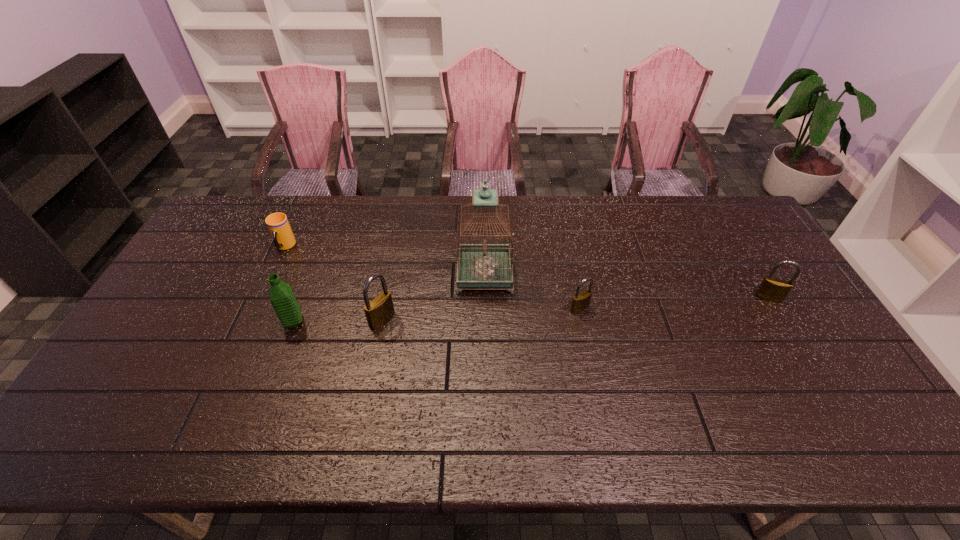
What are the coordinates of `vacant space located on the left of the second padlock from left to right` in the screenshot? It's located at (491, 308).

You are a GUI agent. You are given a task and a screenshot of the screen. Output one action in this format:
    pyautogui.click(x=<x>, y=<y>)
    Task: Click on the vacant space located on the front of the second shortest padlock
    The width and height of the screenshot is (960, 540).
    Given the screenshot: What is the action you would take?
    pyautogui.click(x=791, y=336)

The height and width of the screenshot is (540, 960). Find the location of `vacant space situated at the door of the third object from right to left`. vacant space situated at the door of the third object from right to left is located at coordinates (377, 274).

I want to click on vacant point located 0.240m at the door of the third object from right to left, so point(380,274).

Where is `vacant area located 0.390m at the door of the third object from right to left`? This screenshot has height=540, width=960. vacant area located 0.390m at the door of the third object from right to left is located at coordinates (332, 274).

Where is `vacant space positioned on the side of the cup with the handle`? vacant space positioned on the side of the cup with the handle is located at coordinates (265, 291).

Where is `vacant space located 0.210m on the front of the second object from left to right`? vacant space located 0.210m on the front of the second object from left to right is located at coordinates (265, 400).

Image resolution: width=960 pixels, height=540 pixels. In order to click on object that is at the right edge in this screenshot , I will do `click(772, 289)`.

Locate an element on the screen. Image resolution: width=960 pixels, height=540 pixels. free space at the far edge of the desktop is located at coordinates (422, 210).

You are a GUI agent. You are given a task and a screenshot of the screen. Output one action in this format:
    pyautogui.click(x=<x>, y=<y>)
    Task: Click on the vacant space at the near edge of the desktop
    Image resolution: width=960 pixels, height=540 pixels.
    Given the screenshot: What is the action you would take?
    pyautogui.click(x=320, y=407)